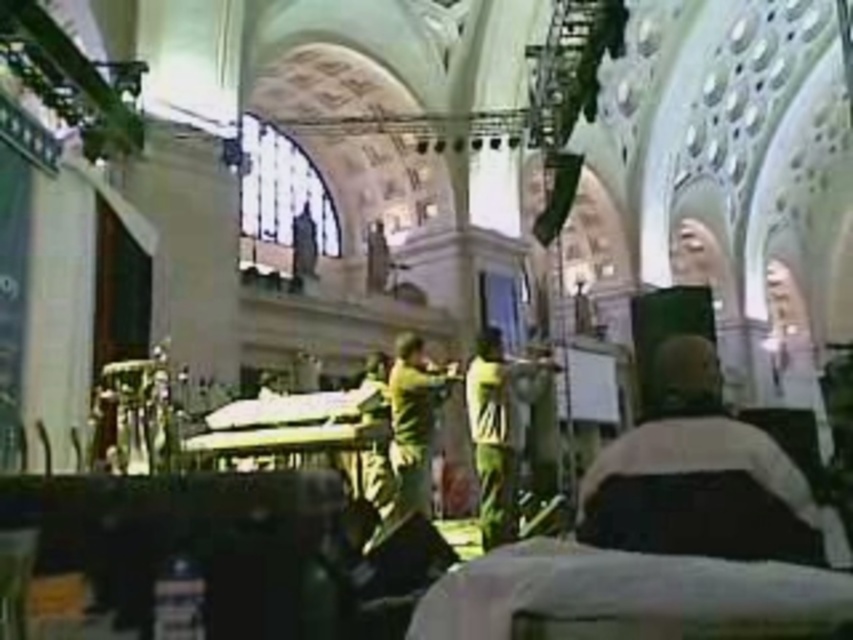
Question: Is dark gray fabric jacket at center in front of green matte shirt at center?

Choices:
 (A) no
 (B) yes

Answer: (B)

Question: Does dark gray fabric jacket at center appear on the right side of green fabric shirt at center?

Choices:
 (A) yes
 (B) no

Answer: (A)

Question: Considering the relative positions of dark gray fabric jacket at center and green matte shirt at center in the image provided, where is dark gray fabric jacket at center located with respect to green matte shirt at center?

Choices:
 (A) above
 (B) below

Answer: (A)

Question: Which point appears closest to the camera in this image?

Choices:
 (A) (473, 422)
 (B) (397, 444)
 (C) (654, 529)

Answer: (C)

Question: Which point is closer to the camera taking this photo?

Choices:
 (A) (692, 499)
 (B) (496, 461)

Answer: (A)

Question: Which object is closer to the camera taking this photo?

Choices:
 (A) green matte shirt at center
 (B) dark gray fabric jacket at center
 (C) green fabric shirt at center

Answer: (B)